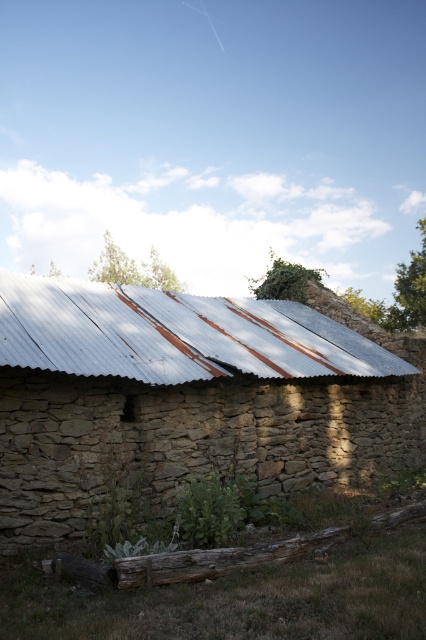
From the picture: Which is more to the left, rusty metal roof at center or rusty wood log at lower center?

rusty metal roof at center

Is point (298, 348) positioned behind point (261, 557)?

Yes, point (298, 348) is behind point (261, 557).

The width and height of the screenshot is (426, 640). Identify the location of rusty metal roof at center. (175, 333).

In the scene shown: Between rusty metal barn at center and rusty wood log at lower center, which one appears on the left side from the viewer's perspective?

Positioned to the left is rusty metal barn at center.

In the scene shown: Can you confirm if rusty metal barn at center is positioned to the left of rusty wood log at lower center?

Indeed, rusty metal barn at center is positioned on the left side of rusty wood log at lower center.

Between point (344, 468) and point (281, 544), which one is positioned behind?

The point (344, 468) is more distant.

This screenshot has height=640, width=426. I want to click on rusty metal barn at center, so pyautogui.click(x=186, y=397).

Which of these two, rusty metal barn at center or rusty metal roof at center, stands taller?

rusty metal barn at center

Consider the image. Can you confirm if rusty metal barn at center is smaller than rusty metal roof at center?

No.

This screenshot has height=640, width=426. I want to click on rusty metal barn at center, so click(186, 397).

In order to click on rusty metal barn at center in this screenshot , I will do `click(186, 397)`.